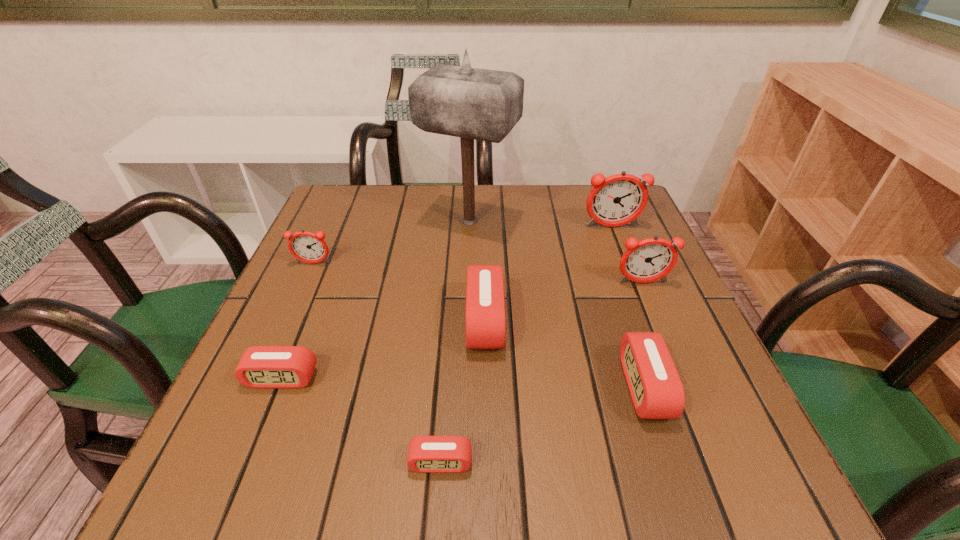
I want to click on the second shortest object, so click(273, 367).

I want to click on the leftmost pink alarm clock, so click(273, 367).

Where is `the nearest alarm clock`? The height and width of the screenshot is (540, 960). the nearest alarm clock is located at coordinates (426, 454).

Find the location of a particular element. the nearest object is located at coordinates (426, 454).

Find the location of `free space located on the right of the tallest object`. free space located on the right of the tallest object is located at coordinates (589, 222).

At what (x,y) coordinates should I click in order to perform the action: click on free space located 0.330m on the front-facing side of the second tallest object. Please return your answer as a coordinate pair (x, y). The image size is (960, 540). Looking at the image, I should click on (653, 333).

Locate an element on the screen. The width and height of the screenshot is (960, 540). free location located on the front-facing side of the nearest reddish-pink alarm clock is located at coordinates (667, 342).

Identify the location of free space located 0.050m on the front-facing side of the leftmost reddish-pink alarm clock. (305, 281).

The height and width of the screenshot is (540, 960). In order to click on vacant space located on the front-facing side of the biggest pink alarm clock in this screenshot , I will do `click(342, 321)`.

I want to click on vacant space located 0.080m on the front-facing side of the biggest pink alarm clock, so click(x=425, y=321).